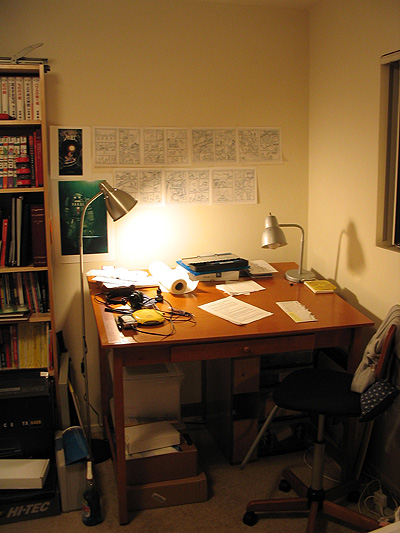
Locate an element on the screen. desk leg is located at coordinates (358, 351), (121, 414), (105, 376).